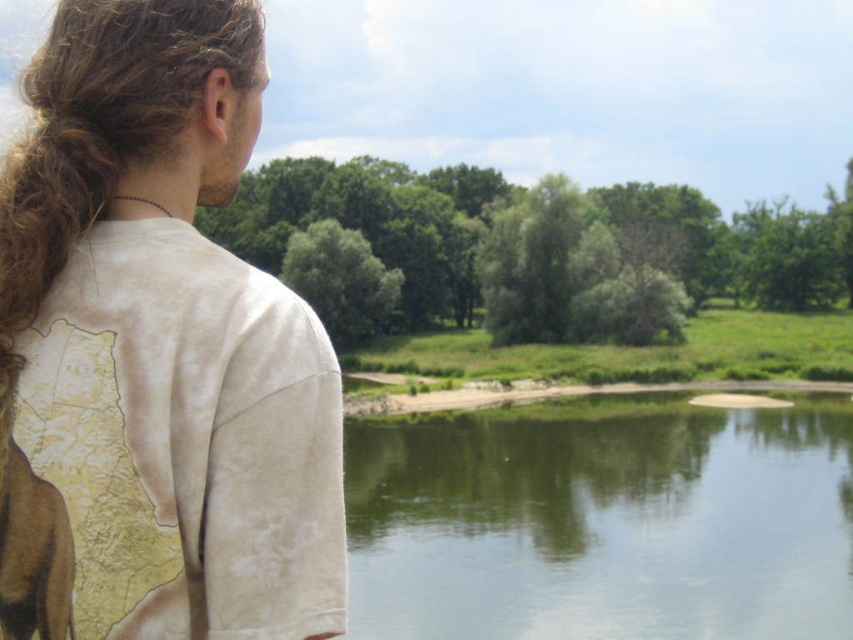
The height and width of the screenshot is (640, 853). Identify the location of white cotton shirt at left. (155, 352).

Which is above, white cotton shirt at left or green smooth water at center?

white cotton shirt at left

Is point (26, 202) more distant than point (347, 632)?

Yes, point (26, 202) is farther from viewer.

In order to click on white cotton shirt at left in this screenshot , I will do `click(155, 352)`.